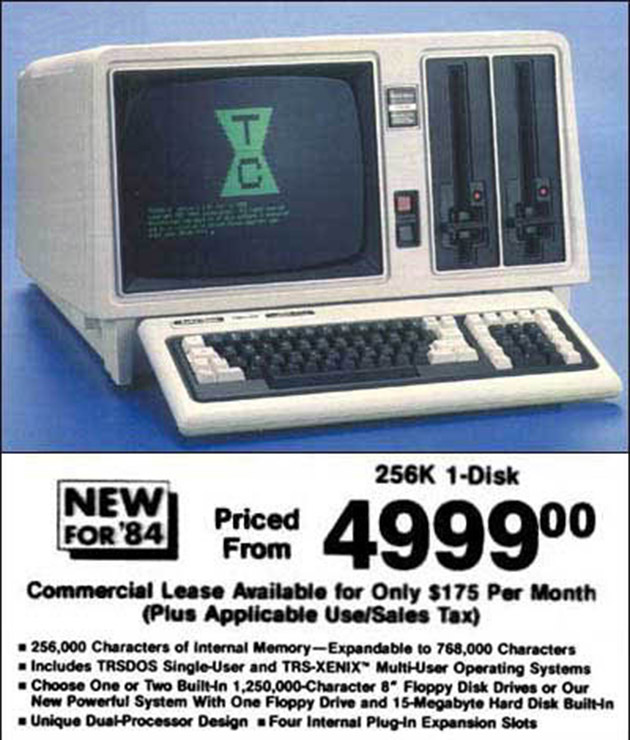
Locate an element on the screen. This screenshot has height=740, width=630. slot for cd is located at coordinates (459, 152), (529, 149).